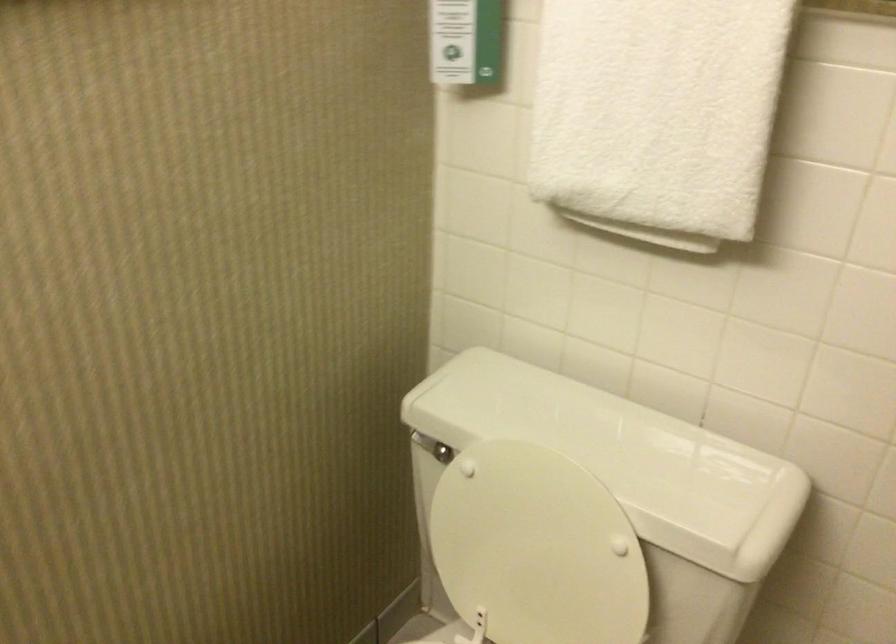
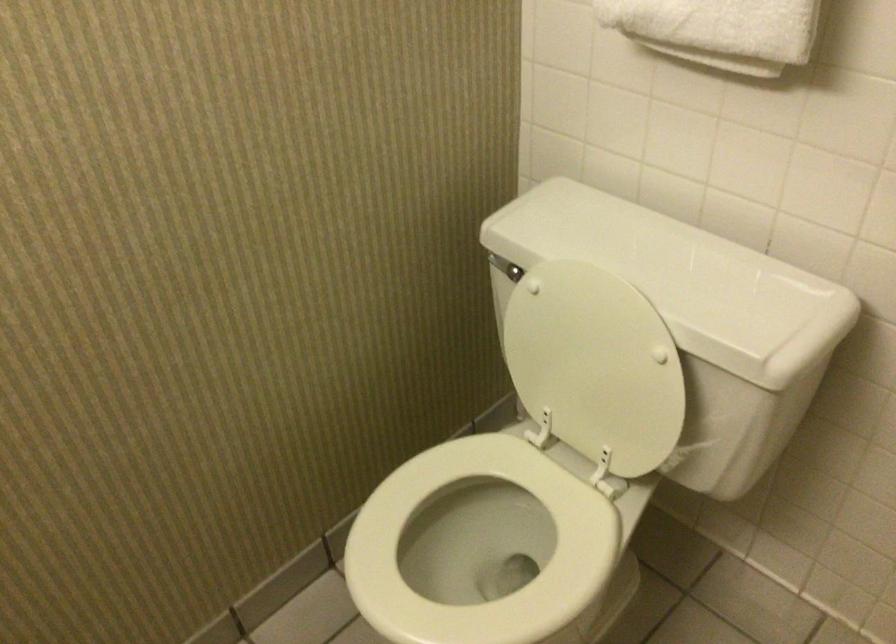
Question: The camera is either moving clockwise (left) or counter-clockwise (right) around the object. The first image is from the beginning of the video and the second image is from the end. Is the camera moving left or right when shooting the video?

Choices:
 (A) Left
 (B) Right

Answer: (B)